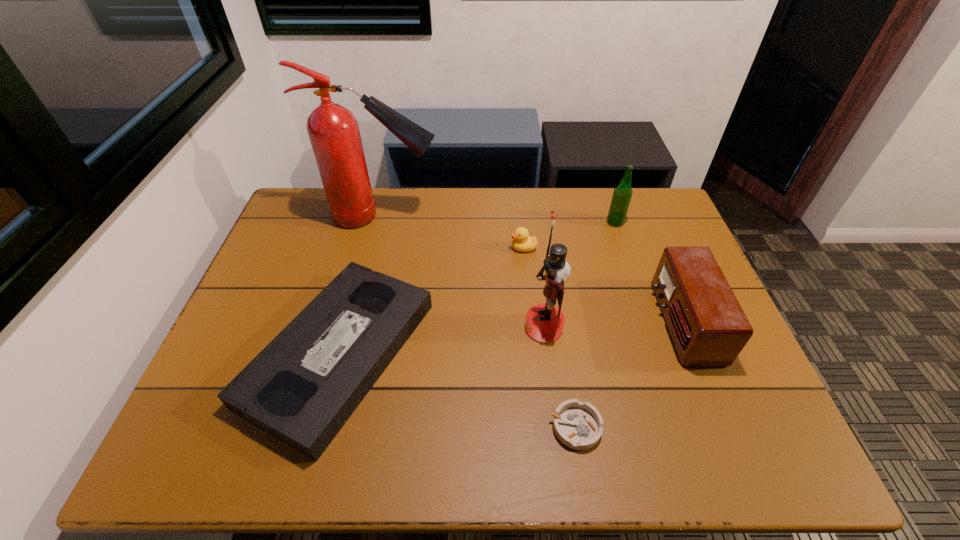
This screenshot has height=540, width=960. Find the location of `free space that satisfies the following two spatial constraints: 1. on the face of the third farthest object; 2. on the front side of the second shortest object`. free space that satisfies the following two spatial constraints: 1. on the face of the third farthest object; 2. on the front side of the second shortest object is located at coordinates (534, 354).

Where is `free location that satisfies the following two spatial constraints: 1. at the nozzle end of the ashtray; 2. on the right side of the tallest object`? The width and height of the screenshot is (960, 540). free location that satisfies the following two spatial constraints: 1. at the nozzle end of the ashtray; 2. on the right side of the tallest object is located at coordinates (330, 427).

You are a GUI agent. You are given a task and a screenshot of the screen. Output one action in this format:
    pyautogui.click(x=<x>, y=<y>)
    Task: Click on the blank area in the image that satisfies the following two spatial constraints: 1. at the nozzle end of the tallest object; 2. on the left side of the ashtray
    The height and width of the screenshot is (540, 960).
    Given the screenshot: What is the action you would take?
    pyautogui.click(x=330, y=427)

What are the coordinates of `blank area in the image that satisfies the following two spatial constraints: 1. on the front-facing side of the nutcracker; 2. on the right side of the shortest object` in the screenshot? It's located at (556, 427).

Identify the location of free space in the image that satisfies the following two spatial constraints: 1. on the label of the fifth shortest object; 2. on the front side of the videotape. (659, 354).

At what (x,y) coordinates should I click in order to perform the action: click on vacant space that satisfies the following two spatial constraints: 1. on the label of the fifth shortest object; 2. on the front side of the shortest object. Please return your answer as a coordinate pair (x, y). The height and width of the screenshot is (540, 960). Looking at the image, I should click on (684, 427).

The width and height of the screenshot is (960, 540). Identify the location of vacant region that satisfies the following two spatial constraints: 1. on the back side of the ashtray; 2. on the front-facing side of the second tallest object. (560, 327).